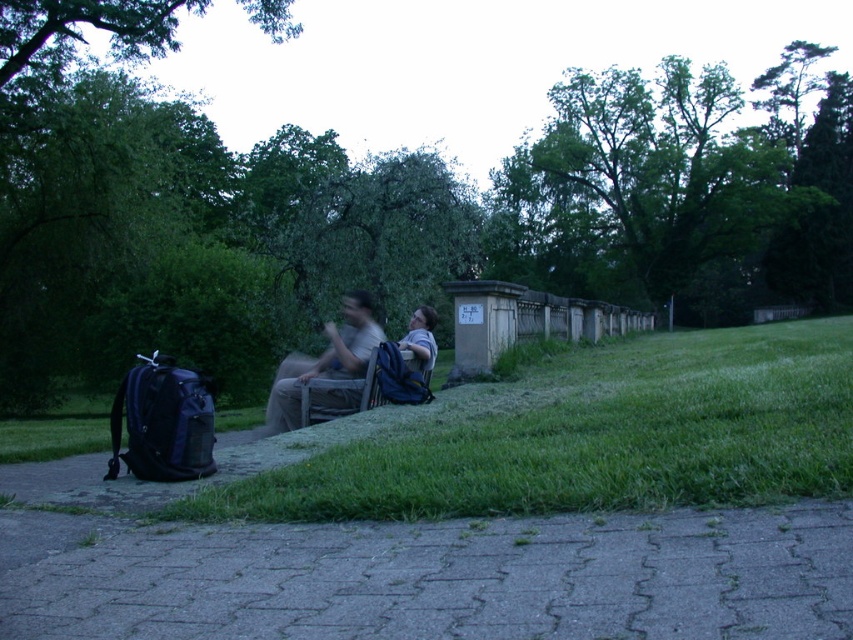
You are standing at the edge of the scene and want to walk towards the gray concrete pavement at lower center and the green grass at lower center. Which surface will you step on first?

The gray concrete pavement at lower center is closer to the viewer than the green grass at lower center, so you will step on the gray concrete pavement at lower center first.

You are planning to lay a new layer of decorative stones over the gray concrete pavement at lower center and the green grass at lower center. Which area requires fewer stones?

The gray concrete pavement at lower center requires fewer stones because it occupies less space than the green grass at lower center according to the description.